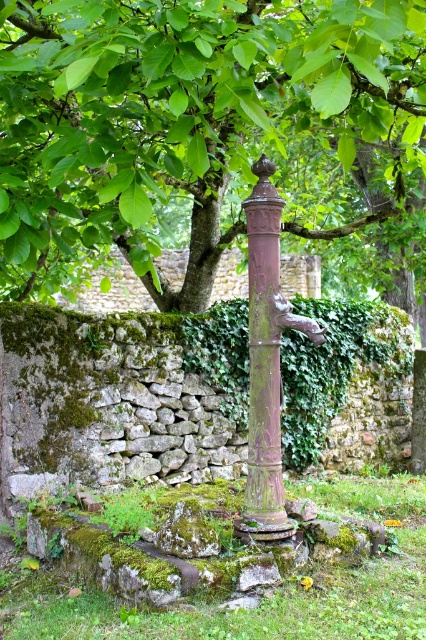
Question: Does green leafy tree at center appear over rusty metal pole at center?

Choices:
 (A) no
 (B) yes

Answer: (B)

Question: Does green leafy tree at center appear on the right side of rusty metal pole at center?

Choices:
 (A) yes
 (B) no

Answer: (B)

Question: Which point is farther to the camera?

Choices:
 (A) (54, 189)
 (B) (270, 364)

Answer: (B)

Question: Which of the following is the closest to the observer?

Choices:
 (A) pos(118,58)
 (B) pos(252,368)

Answer: (A)

Question: Which point is farther to the camera?

Choices:
 (A) (250, 496)
 (B) (8, 202)

Answer: (A)

Question: In this image, where is green leafy tree at center located relative to rusty metal pole at center?

Choices:
 (A) below
 (B) above

Answer: (B)